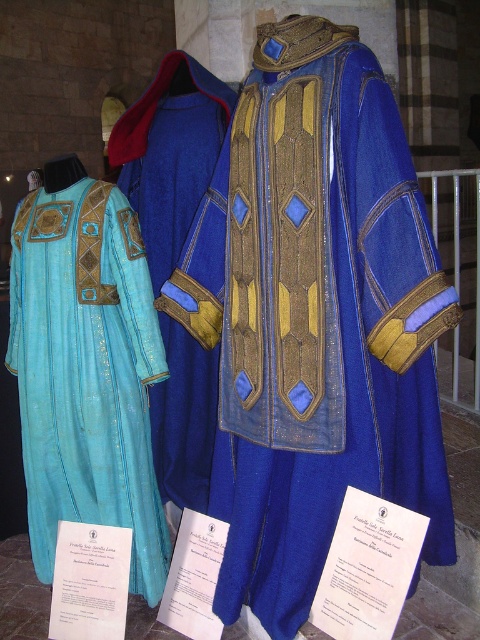
Looking at this image, does matte blue fabric robe at left appear on the left side of velvet blue robe at center?

Correct, you'll find matte blue fabric robe at left to the left of velvet blue robe at center.

Between point (15, 312) and point (206, 356), which one is positioned in front?

Point (206, 356)

Where is `matte blue fabric robe at left`? matte blue fabric robe at left is located at coordinates (86, 372).

Is point (321, 168) closer to camera compared to point (200, 70)?

Yes, it is.

Does blue velvet jacket at center have a smaller size compared to velvet blue robe at center?

No, blue velvet jacket at center is not smaller than velvet blue robe at center.

Find the location of a particular element. blue velvet jacket at center is located at coordinates (314, 317).

The height and width of the screenshot is (640, 480). What do you see at coordinates (314, 317) in the screenshot?
I see `blue velvet jacket at center` at bounding box center [314, 317].

Between blue velvet jacket at center and matte blue fabric robe at left, which one appears on the right side from the viewer's perspective?

blue velvet jacket at center is more to the right.

The height and width of the screenshot is (640, 480). Describe the element at coordinates (314, 317) in the screenshot. I see `blue velvet jacket at center` at that location.

Identify the location of blue velvet jacket at center. (314, 317).